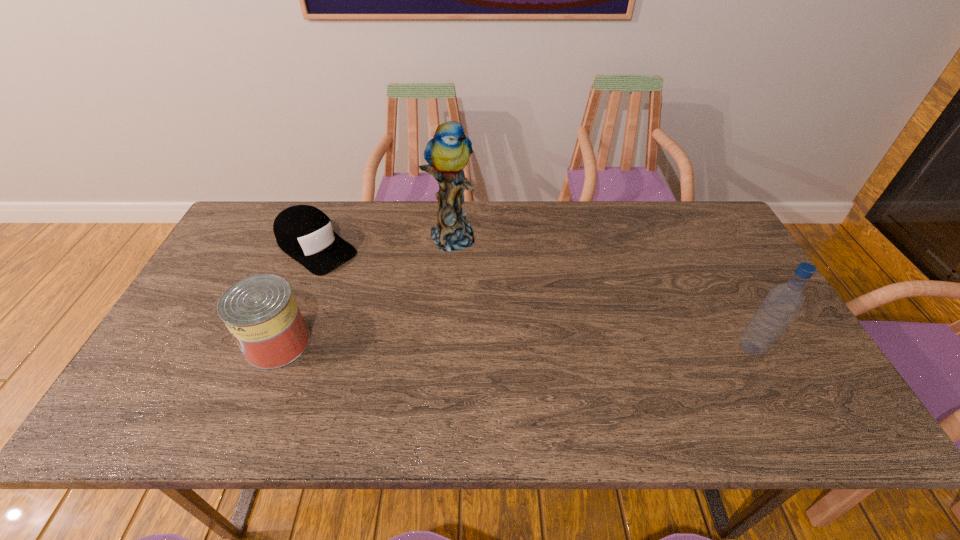
Identify the location of the third tallest object. (261, 313).

Locate an element on the screen. The height and width of the screenshot is (540, 960). the third shortest object is located at coordinates (782, 303).

Where is `water bottle`? This screenshot has height=540, width=960. water bottle is located at coordinates (782, 303).

This screenshot has width=960, height=540. Find the location of `the second object from right to left`. the second object from right to left is located at coordinates click(447, 153).

Where is `parrot`? parrot is located at coordinates (447, 153).

Locate an element on the screen. The image size is (960, 540). the shortest object is located at coordinates (305, 233).

Image resolution: width=960 pixels, height=540 pixels. What are the coordinates of `vacant area situated 0.400m on the right of the third tallest object` in the screenshot? It's located at (469, 343).

The height and width of the screenshot is (540, 960). Find the location of `vacant space positioned on the back of the water bottle`. vacant space positioned on the back of the water bottle is located at coordinates (718, 286).

In order to click on free space located on the face of the second object from right to left in this screenshot , I will do `click(485, 287)`.

You are a GUI agent. You are given a task and a screenshot of the screen. Output one action in this format:
    pyautogui.click(x=<x>, y=<y>)
    Task: Click on the free spot located on the face of the second object from right to left
    This screenshot has height=540, width=960.
    Given the screenshot: What is the action you would take?
    [x=522, y=337]